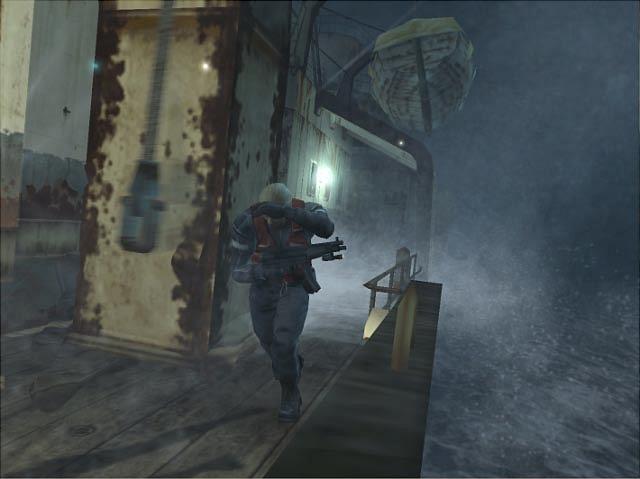
Locate an element on the screen. This screenshot has width=640, height=479. wood planks is located at coordinates coord(176,420), coord(243,442), coord(118,396), coord(80,374), coord(40,345).